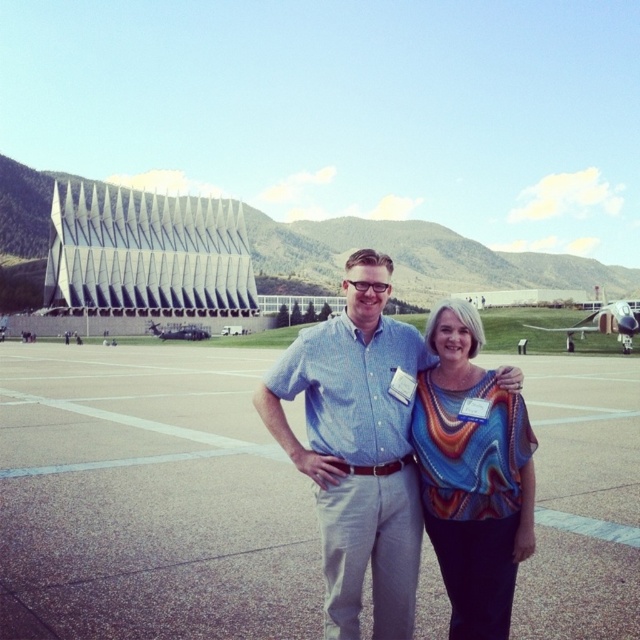
Question: Which of the following is the farthest from the observer?

Choices:
 (A) (134, 552)
 (B) (493, 625)

Answer: (A)

Question: Does concrete tarmac at center appear on the right side of blue cotton shirt at center?

Choices:
 (A) yes
 (B) no

Answer: (B)

Question: Which of the following is the closest to the observer?

Choices:
 (A) (492, 545)
 (B) (385, 556)
 (C) (544, 508)

Answer: (A)

Question: Considering the relative positions of concrete tarmac at center and multicolored woven blouse at center in the image provided, where is concrete tarmac at center located with respect to multicolored woven blouse at center?

Choices:
 (A) above
 (B) below

Answer: (B)

Question: Estimate the real-world distances between objects in this image. Which object is farther from the multicolored woven blouse at center?

Choices:
 (A) blue cotton shirt at center
 (B) concrete tarmac at center

Answer: (B)

Question: Is concrete tarmac at center to the right of blue cotton shirt at center from the viewer's perspective?

Choices:
 (A) no
 (B) yes

Answer: (A)